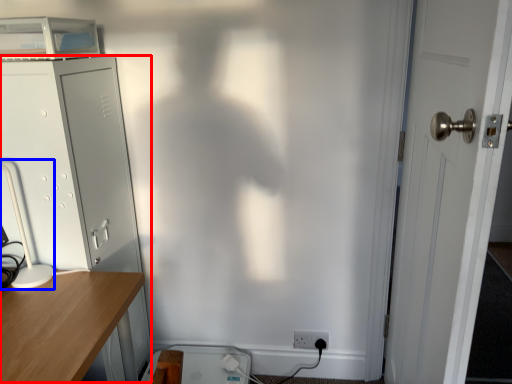
Question: Among these objects, which one is nearest to the camera, file cabinet (highlighted by a red box) or table lamp (highlighted by a blue box)?

Choices:
 (A) file cabinet
 (B) table lamp

Answer: (B)